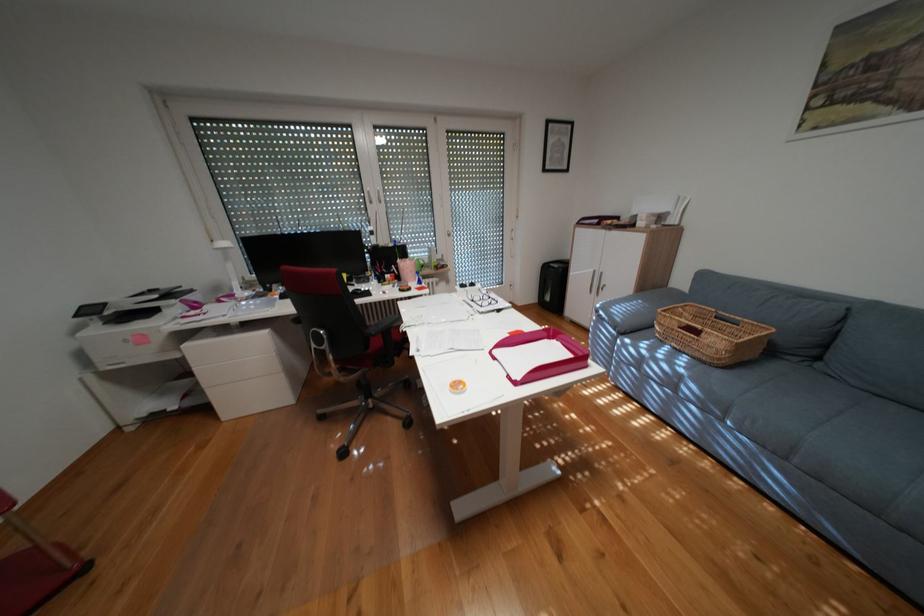
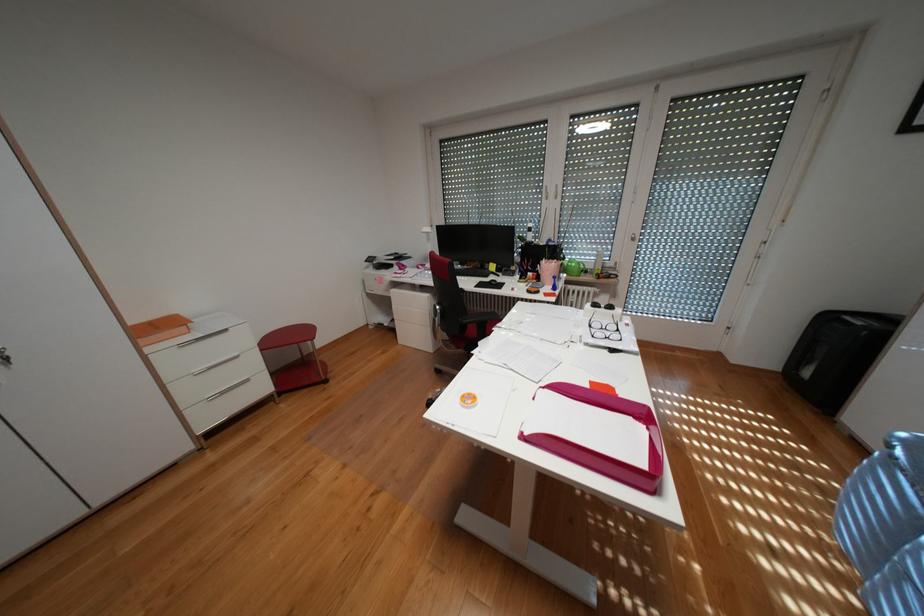
Where in the second image is the point corresponding to point (484, 300) from the first image?

(602, 325)